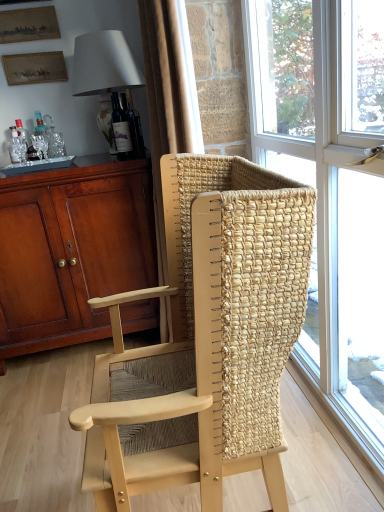
This screenshot has height=512, width=384. I want to click on vacant area that is in front of matte glass bottle at upper center, so click(115, 163).